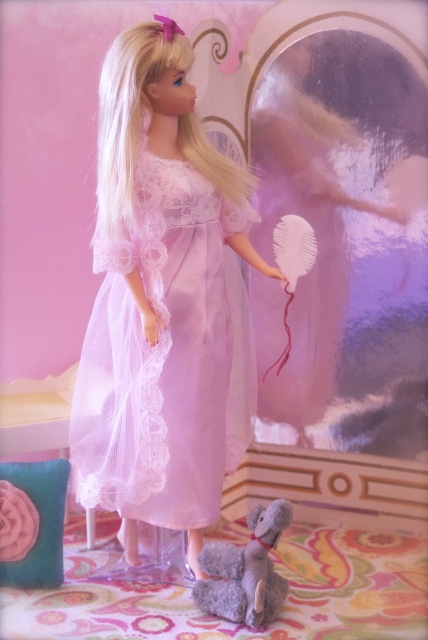
Consider the image. You are organizing a dollhouse and need to place the lace fabric dress at center and the gray plush toy at lower center. Which item should you place first if you want to ensure the larger item is visible?

You should place the lace fabric dress at center first because it has a larger size compared to the gray plush toy at lower center, ensuring it remains visible.